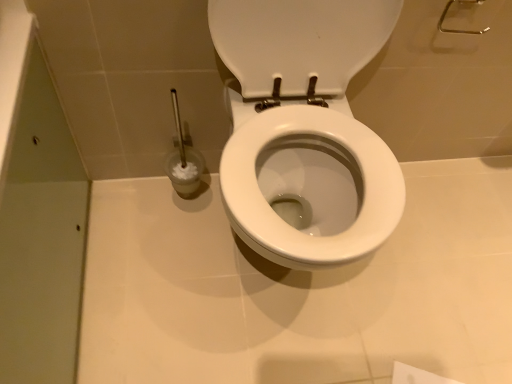
Identify the location of vacant space to the left of clear plastic brush at left. (125, 193).